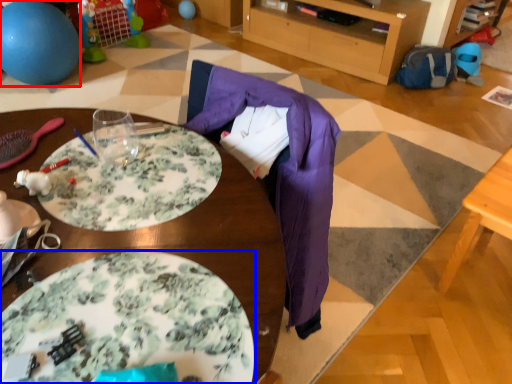
Question: Which point is closer to the camera, ball (highlighted by a red box) or plate (highlighted by a blue box)?

Choices:
 (A) ball
 (B) plate

Answer: (B)